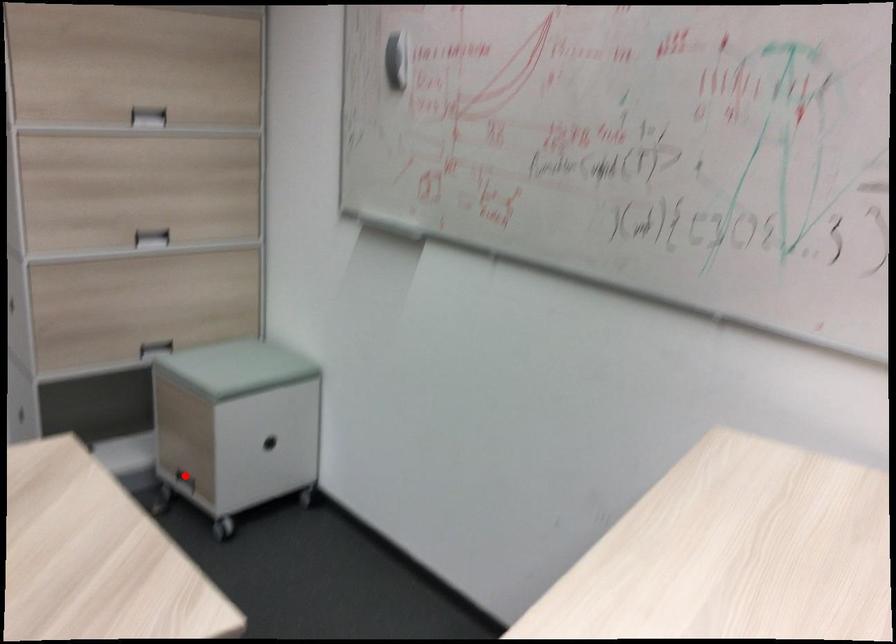
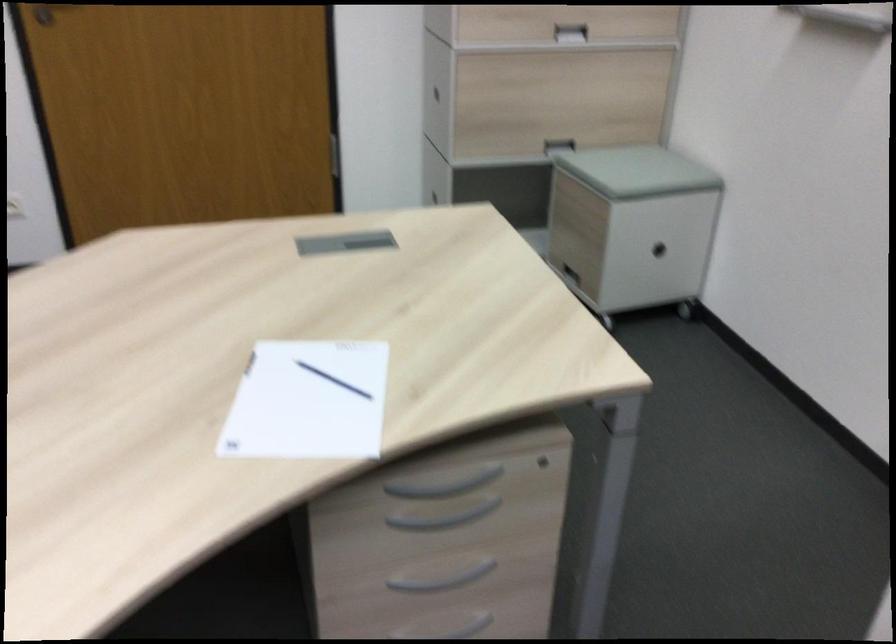
Find the pixel in the second image that matches the highlighted location in the first image.

(569, 270)